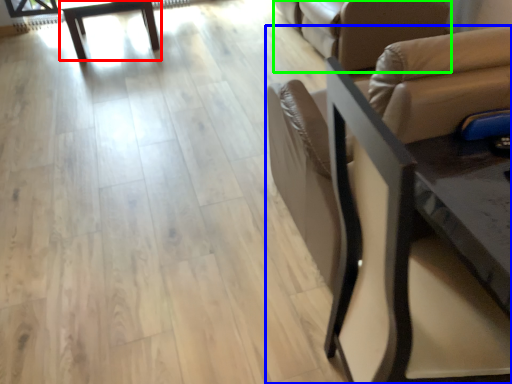
Question: Estimate the real-world distances between objects in this image. Which object is farther from table (highlighted by a red box), chair (highlighted by a blue box) or futon (highlighted by a green box)?

Choices:
 (A) chair
 (B) futon

Answer: (A)